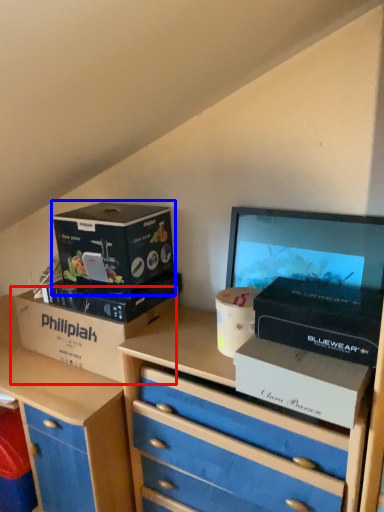
Question: Which point is closer to the camera, box (highlighted by a red box) or box (highlighted by a blue box)?

Choices:
 (A) box
 (B) box

Answer: (B)